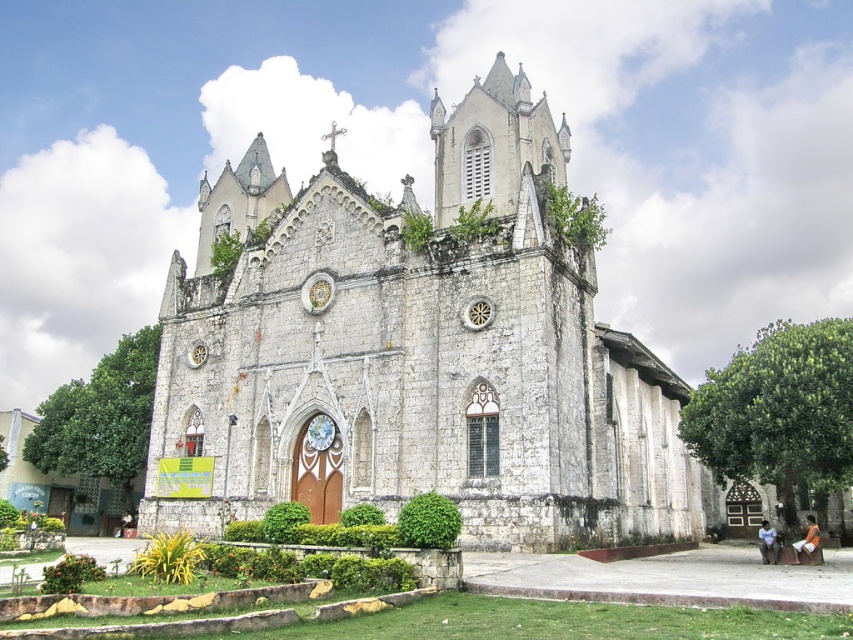
Between white stone chapel at center and blue denim shirt at lower right, which one is positioned lower?

Positioned lower is blue denim shirt at lower right.

The width and height of the screenshot is (853, 640). What do you see at coordinates (415, 353) in the screenshot?
I see `white stone chapel at center` at bounding box center [415, 353].

Measure the distance between point (x=267, y=237) and camera.

The distance of point (x=267, y=237) from camera is 233.36 feet.

In order to click on white stone chapel at center in this screenshot , I will do `click(415, 353)`.

Is point (349, 332) positioned before point (815, 536)?

No.

Which is in front, point (316, 397) or point (811, 518)?

Point (316, 397) is in front.

Is point (582, 372) in front of point (813, 524)?

No, it is behind (813, 524).

Locate an element on the screen. This screenshot has height=640, width=853. white stone chapel at center is located at coordinates (415, 353).

Between blue denim shirt at lower right and orange cotton shorts at lower right, which one is positioned higher?

Positioned higher is orange cotton shorts at lower right.

Which is more to the right, blue denim shirt at lower right or orange cotton shorts at lower right?

orange cotton shorts at lower right is more to the right.

Describe the element at coordinates (767, 544) in the screenshot. This screenshot has width=853, height=640. I see `blue denim shirt at lower right` at that location.

Where is `blue denim shirt at lower right`? blue denim shirt at lower right is located at coordinates (767, 544).